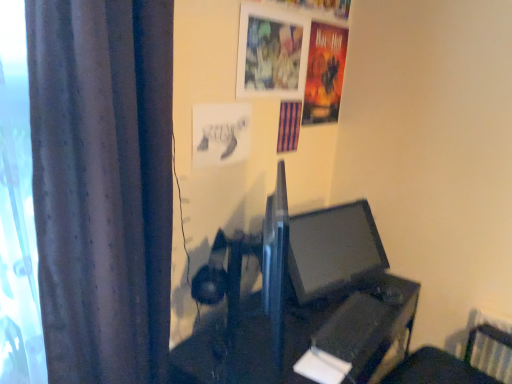
Question: In terms of size, does black plastic table at center appear bigger or smaller than white paper at upper center, placed as the 3th poster page when sorted from back to front?

Choices:
 (A) small
 (B) big

Answer: (B)

Question: Is point (375, 327) positioned closer to the camera than point (212, 165)?

Choices:
 (A) closer
 (B) farther

Answer: (B)

Question: Which object is positioned farthest from the matte black monitor at center?

Choices:
 (A) white paper at upper center, acting as the 3th poster page starting from the right
 (B) metallic silver picture frame at upper center
 (C) purple striped poster at upper center, placed as the 2th poster page when sorted from right to left
 (D) black plastic table at center
 (E) dark grey fabric curtain at left

Answer: (E)

Question: Based on their relative distances, which object is nearer to the dark grey fabric curtain at left?

Choices:
 (A) white paper at upper center, acting as the 3th poster page starting from the right
 (B) matt paper poster at upper right, which is counted as the third poster page, starting from the left
 (C) metallic silver picture frame at upper center
 (D) black plastic table at center
 (E) purple striped poster at upper center, the 2th poster page viewed from the left

Answer: (A)